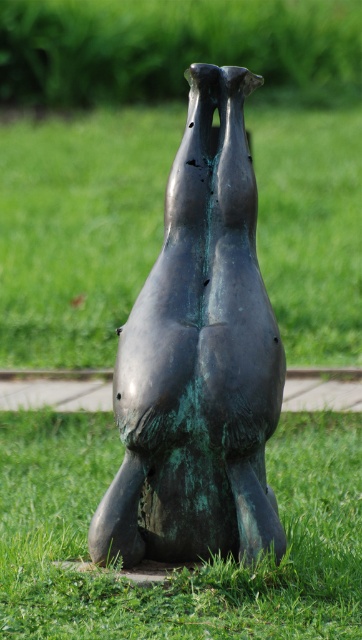
You are standing in front of the bronze sculpture and want to take a photo. The two points on the sculpture are labeled as point (234,403) and point (35,548). Which point is closer to you when you are facing the sculpture?

Point (234,403) is in front of point (35,548), so it is closer to you when facing the sculpture.

Based on the coordinates provided in the description, where is the green patina bronze sculpture at center located in the image?

The green patina bronze sculpture at center is located at the coordinates point (199, 358).

Looking at this image, you are standing in a park and see the green patina bronze sculpture at center. There is a point marked at coordinates (199, 358). Where exactly is this point located?

The point at coordinates (199, 358) is on the green patina bronze sculpture at center.